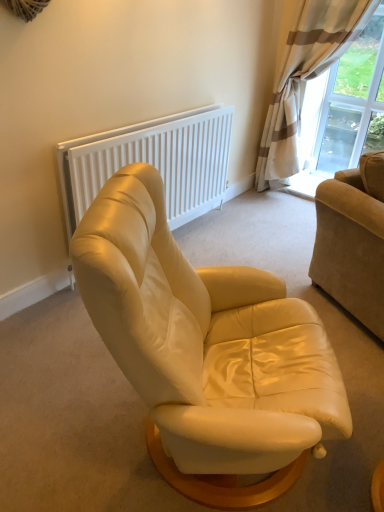
Question: From the image's perspective, is beige striped curtain at upper right located above or below transparent glass window at upper right?

Choices:
 (A) below
 (B) above

Answer: (A)

Question: Based on their sizes in the image, would you say beige striped curtain at upper right is bigger or smaller than transparent glass window at upper right?

Choices:
 (A) big
 (B) small

Answer: (A)

Question: Which of these objects is positioned farthest from the beige corduroy couch at right?

Choices:
 (A) transparent glass window at upper right
 (B) beige striped curtain at upper right
 (C) white matte radiator at upper center
 (D) matte cream leather armchair at center

Answer: (A)

Question: Which is nearer to the matte cream leather armchair at center?

Choices:
 (A) white matte radiator at upper center
 (B) beige corduroy couch at right
 (C) transparent glass window at upper right
 (D) beige striped curtain at upper right

Answer: (B)